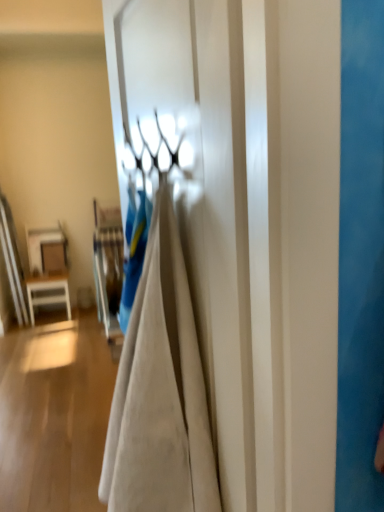
Where is `white glossy table at left`? This screenshot has height=512, width=384. white glossy table at left is located at coordinates (41, 242).

Describe the element at coordinates (41, 242) in the screenshot. I see `white glossy table at left` at that location.

What do you see at coordinates (218, 230) in the screenshot?
I see `white matte door at center` at bounding box center [218, 230].

Measure the distance between point (x=214, y=139) and camera.

They are 26.65 inches apart.

You are a GUI agent. You are given a task and a screenshot of the screen. Output one action in this format:
    pyautogui.click(x=<x>, y=<y>)
    Task: Click on the white matte door at center
    The image size is (384, 512).
    Given the screenshot: What is the action you would take?
    pyautogui.click(x=218, y=230)

The image size is (384, 512). I want to click on white glossy table at left, so click(x=41, y=242).

Considering the relative positions of white glossy table at left and white matte door at center in the image provided, is white glossy table at left to the left or to the right of white matte door at center?

Based on their positions, white glossy table at left is located to the left of white matte door at center.

Which object is further away from the camera, white glossy table at left or white matte door at center?

Positioned behind is white glossy table at left.

Is point (40, 228) farther from camera compared to point (215, 19)?

Yes, it is behind point (215, 19).

From the picture: From the image's perspective, is white glossy table at left above or below white matte door at center?

white glossy table at left is below white matte door at center.

From a real-world perspective, is white glossy table at left physically above white matte door at center?

Actually, white glossy table at left is physically below white matte door at center in the real world.

Between white glossy table at left and white matte door at center, which one has larger width?

Wider between the two is white glossy table at left.

Considering the sizes of objects white glossy table at left and white matte door at center in the image provided, who is shorter, white glossy table at left or white matte door at center?

Standing shorter between the two is white glossy table at left.

Which of these two, white glossy table at left or white matte door at center, is smaller?

white glossy table at left.

Would you say white matte door at center is part of white glossy table at left's contents?

No, white glossy table at left does not contain white matte door at center.

Is white glossy table at left beside white matte door at center?

No, white glossy table at left is not with white matte door at center.

Is white glossy table at left oriented away from white matte door at center?

No, white matte door at center is not at the back of white glossy table at left.

You are a GUI agent. You are given a task and a screenshot of the screen. Output one action in this format:
    pyautogui.click(x=<x>, y=<y>)
    Task: Click on the table that is on the left side of white matte door at center
    The image size is (384, 512).
    Given the screenshot: What is the action you would take?
    pyautogui.click(x=41, y=242)

Based on their positions, is white matte door at center located to the left or right of white glossy table at left?

From the image, it's evident that white matte door at center is to the right of white glossy table at left.

Which object is closer to the camera, white matte door at center or white glossy table at left?

white matte door at center is more forward.

Is point (185, 92) closer to camera compared to point (36, 264)?

Yes, it is.

From the image's perspective, is white matte door at center above or below white glossy table at left?

white matte door at center is situated higher than white glossy table at left in the image.

From a real-world perspective, which object stands above the other?

white matte door at center.

Between white matte door at center and white glossy table at left, which one has smaller width?

With smaller width is white matte door at center.

Considering the relative sizes of white matte door at center and white glossy table at left in the image provided, is white matte door at center taller than white glossy table at left?

Correct, white matte door at center is much taller as white glossy table at left.

Does white matte door at center have a larger size compared to white glossy table at left?

Correct, white matte door at center is larger in size than white glossy table at left.

Is white matte door at center not inside white glossy table at left?

Absolutely, white matte door at center is external to white glossy table at left.

Can you see white matte door at center touching white glossy table at left?

No, white matte door at center is not touching white glossy table at left.

Could you tell me if white matte door at center is facing white glossy table at left?

No, white matte door at center is not turned towards white glossy table at left.

Find the location of a particular element. The image size is (384, 512). table that appears behind the white matte door at center is located at coordinates (41, 242).

I want to click on door that appears on the right of white glossy table at left, so click(x=218, y=230).

Identify the location of door located above the white glossy table at left (from the image's perspective). (218, 230).